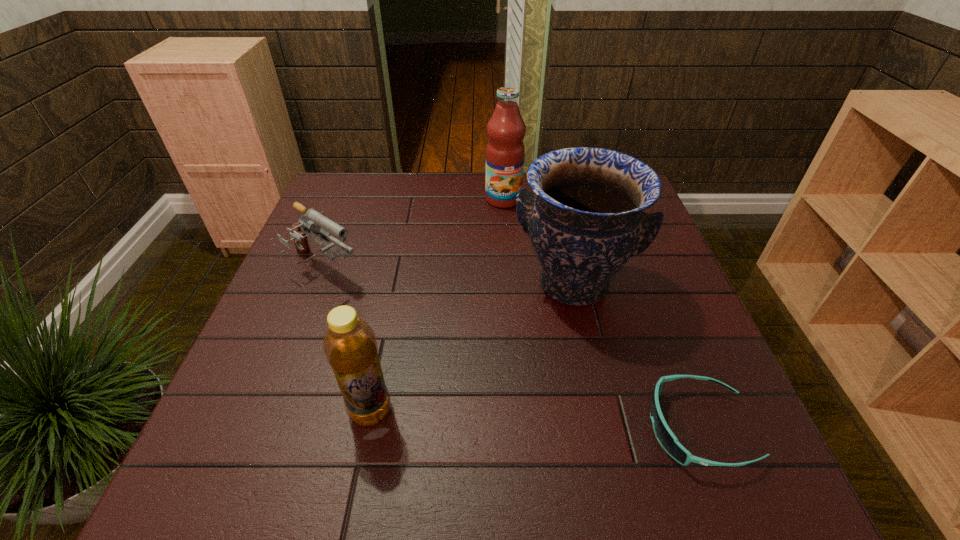
Find the location of `bottle located at the near edge`. bottle located at the near edge is located at coordinates (350, 346).

This screenshot has height=540, width=960. I want to click on sunglasses that is at the near edge, so click(669, 442).

Where is `object positioned at the left edge`? object positioned at the left edge is located at coordinates (316, 223).

Identify the location of sunglasses situated at the right edge. Image resolution: width=960 pixels, height=540 pixels. (669, 442).

This screenshot has height=540, width=960. What are the coordinates of `pottery situated at the right edge` in the screenshot? It's located at (585, 221).

Identify the location of object that is at the near right corner. Image resolution: width=960 pixels, height=540 pixels. (669, 442).

Where is `free space at the left edge of the desktop`? The image size is (960, 540). free space at the left edge of the desktop is located at coordinates (267, 325).

I want to click on vacant space at the right edge, so click(669, 363).

The width and height of the screenshot is (960, 540). I want to click on vacant space at the far left corner of the desktop, so click(352, 176).

You are a GUI agent. You are given a task and a screenshot of the screen. Output one action in this format:
    pyautogui.click(x=<x>, y=<y>)
    Task: Click on the vacant point located between the leftmost object and the farthest object
    This screenshot has width=960, height=540.
    Given the screenshot: What is the action you would take?
    pyautogui.click(x=415, y=234)